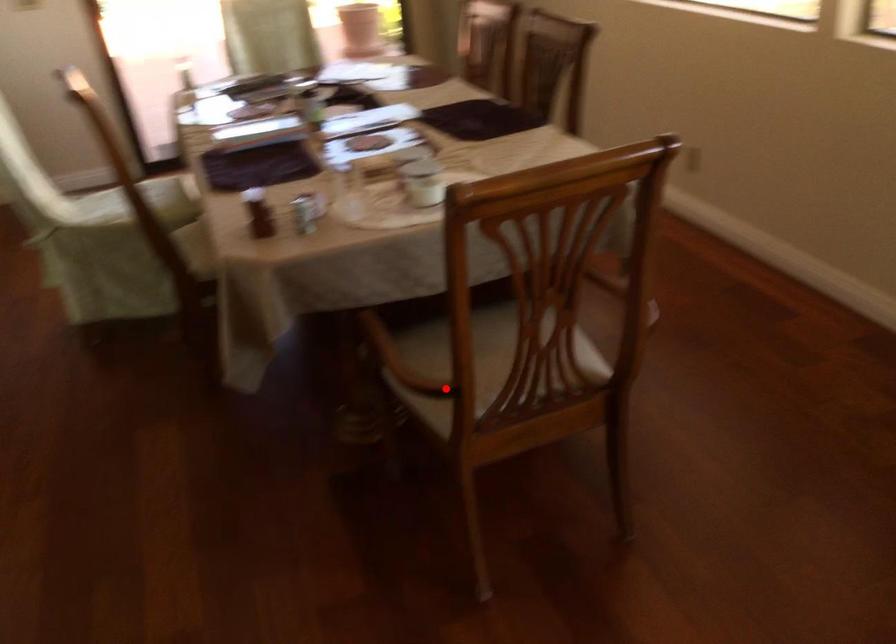
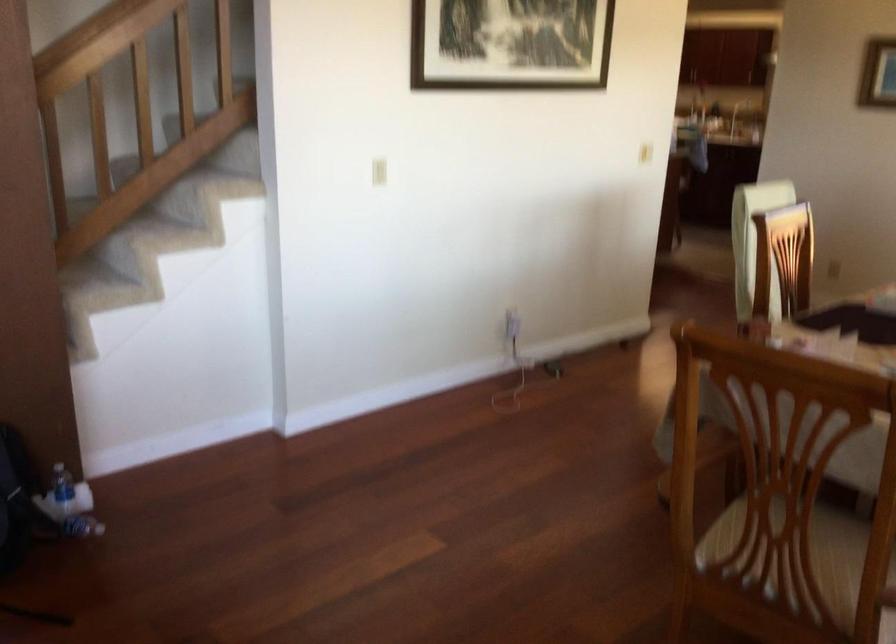
Find the pixel in the second image that matches the highlighted location in the first image.

(736, 532)